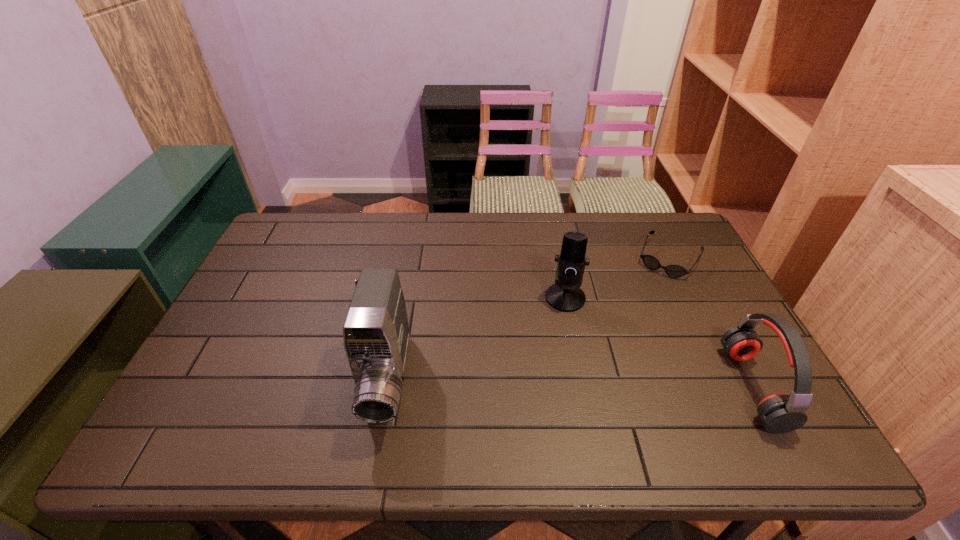
Find the location of a particular element. vacant spot on the desktop that is between the camcorder and the earphone and is positioned on the lenses of the sunglasses is located at coordinates (604, 384).

Find the location of a particular element. This screenshot has height=540, width=960. free space on the desktop that is between the camcorder and the earphone and is positioned on the stand of the microphone is located at coordinates (529, 383).